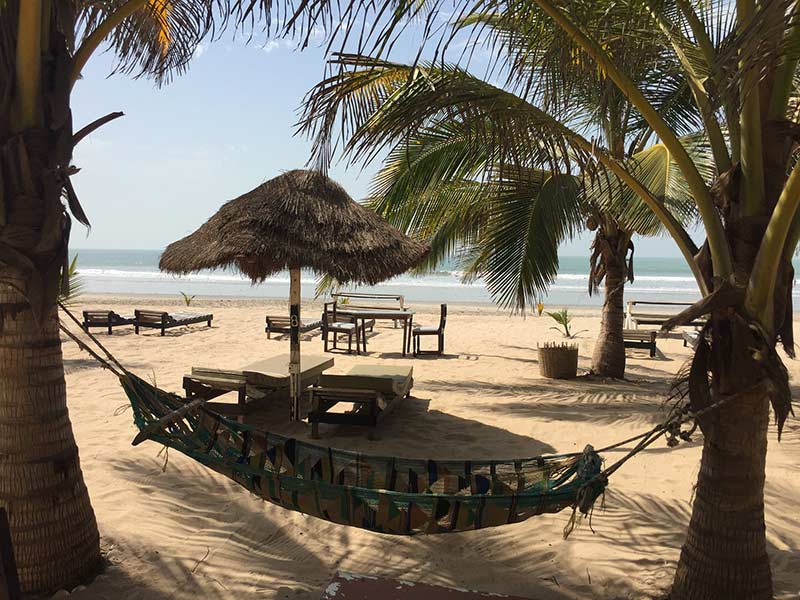
What are the coordinates of `black lounge chairs` in the screenshot? It's located at (161, 318), (105, 317).